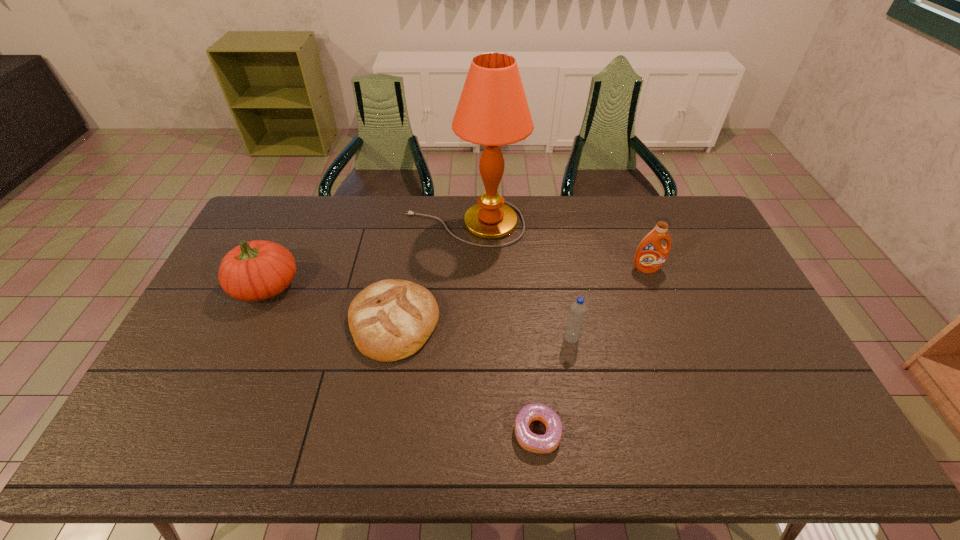
The height and width of the screenshot is (540, 960). In order to click on the farthest object in this screenshot , I will do `click(493, 111)`.

Where is `lamp`? lamp is located at coordinates tap(493, 111).

At what (x,y) coordinates should I click in order to perform the action: click on the rightmost object. Please return your answer as a coordinate pair (x, y). Image resolution: width=960 pixels, height=540 pixels. Looking at the image, I should click on [650, 256].

Find the location of a particular element. The width and height of the screenshot is (960, 540). pumpkin is located at coordinates (257, 270).

At what (x,y) coordinates should I click in order to perform the action: click on the fifth object from left to right. Please return your answer as a coordinate pair (x, y). The width and height of the screenshot is (960, 540). Looking at the image, I should click on (578, 309).

Where is `bread`? bread is located at coordinates (390, 320).

Locate an element on the screen. the nearest object is located at coordinates (547, 443).

The image size is (960, 540). I want to click on the shortest object, so click(x=547, y=443).

Where is `vacant space located 0.150m on the front of the farthest object`? The width and height of the screenshot is (960, 540). vacant space located 0.150m on the front of the farthest object is located at coordinates click(x=463, y=280).

This screenshot has height=540, width=960. In order to click on vacant region located on the front-facing side of the rightmost object in this screenshot , I will do `click(659, 300)`.